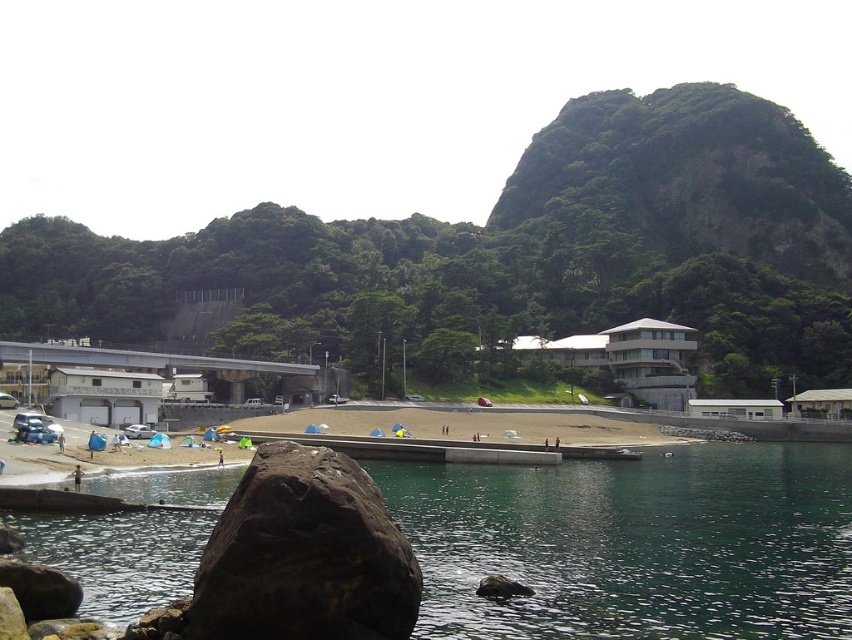
Question: Considering the relative positions of green leafy mountain at upper center and dark brown rock at lower left in the image provided, where is green leafy mountain at upper center located with respect to dark brown rock at lower left?

Choices:
 (A) right
 (B) left

Answer: (A)

Question: Which point appears closest to the camera in this image?

Choices:
 (A) (128, 561)
 (B) (479, 326)
 (C) (204, 563)

Answer: (C)

Question: Which point appears closest to the camera in this image?

Choices:
 (A) (108, 531)
 (B) (200, 588)
 (C) (75, 484)

Answer: (B)

Question: Can you confirm if green leafy mountain at upper center is positioned to the right of skinny person at lower left?

Choices:
 (A) yes
 (B) no

Answer: (A)

Question: Which object is closer to the camera taking this photo?

Choices:
 (A) dark brown rock at lower left
 (B) green leafy mountain at upper center

Answer: (A)

Question: Considering the relative positions of green leafy mountain at upper center and clear water at lower center in the image provided, where is green leafy mountain at upper center located with respect to clear water at lower center?

Choices:
 (A) right
 (B) left

Answer: (A)